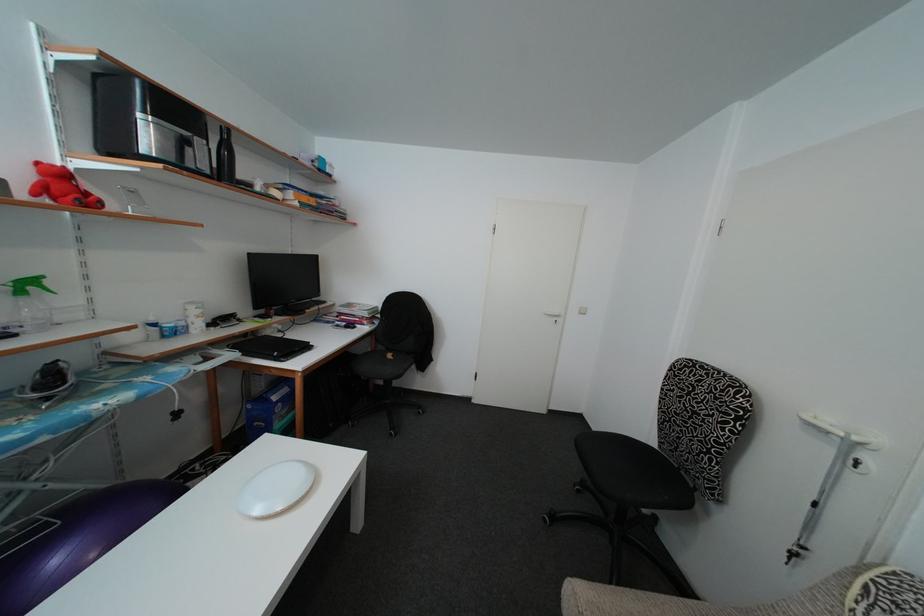
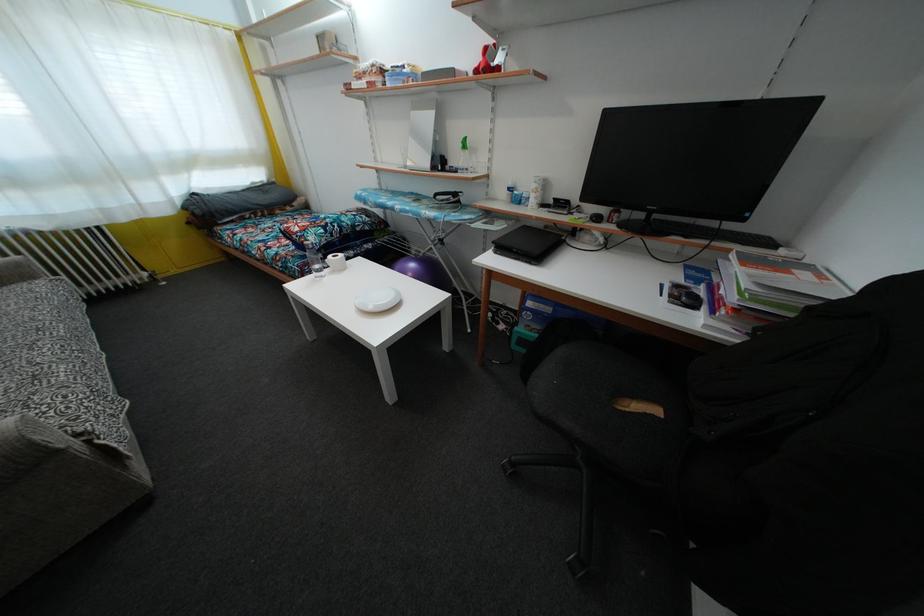
Locate, in the second image, the point that corresponds to point (65, 180) in the first image.

(490, 58)